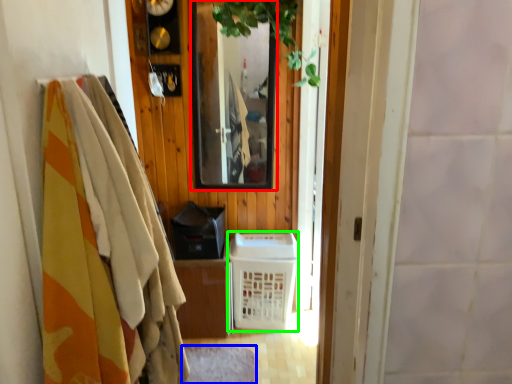
Question: Which object is positioned farthest from mirror (highlighted by a red box)? Select from mat (highlighted by a blue box) and basket (highlighted by a green box).

Choices:
 (A) mat
 (B) basket

Answer: (A)